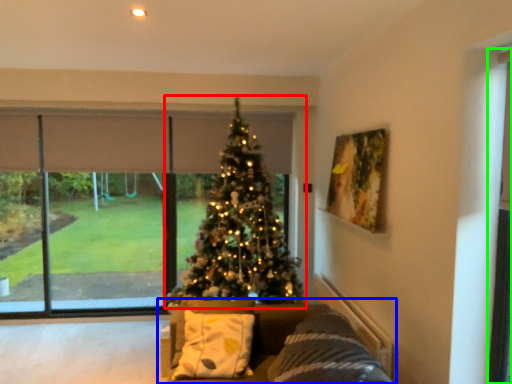
Question: Considering the real-world distances, which object is closest to christmas tree (highlighted by a red box)? studio couch (highlighted by a blue box) or screen door (highlighted by a green box).

Choices:
 (A) studio couch
 (B) screen door

Answer: (A)